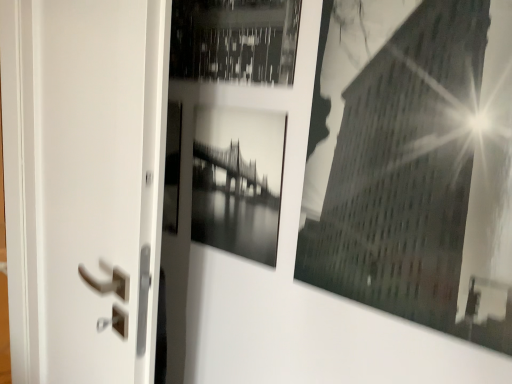
Question: Looking at their shapes, would you say white matte screen door at left is wider or thinner than black glossy building at upper right, which ranks as the second picture frame in left-to-right order?

Choices:
 (A) thin
 (B) wide

Answer: (B)

Question: From a real-world perspective, is white matte screen door at left physically located above or below black glossy building at upper right, the 1th picture frame viewed from the right?

Choices:
 (A) below
 (B) above

Answer: (A)

Question: Estimate the real-world distances between objects in this image. Which object is closer to the white matte screen door at left?

Choices:
 (A) black glossy building at upper right, which ranks as the second picture frame in left-to-right order
 (B) black glossy photo frame at center, which appears as the second picture frame when viewed from the right

Answer: (B)

Question: Which of these objects is positioned farthest from the black glossy photo frame at center, arranged as the first picture frame when viewed from the left?

Choices:
 (A) white matte screen door at left
 (B) black glossy building at upper right, the 1th picture frame viewed from the right

Answer: (A)